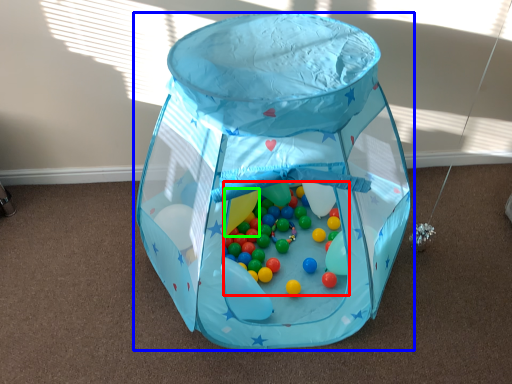
Question: Which is farther away from toy (highlighted by a red box)? toy (highlighted by a blue box) or balloon (highlighted by a green box)?

Choices:
 (A) toy
 (B) balloon

Answer: (A)